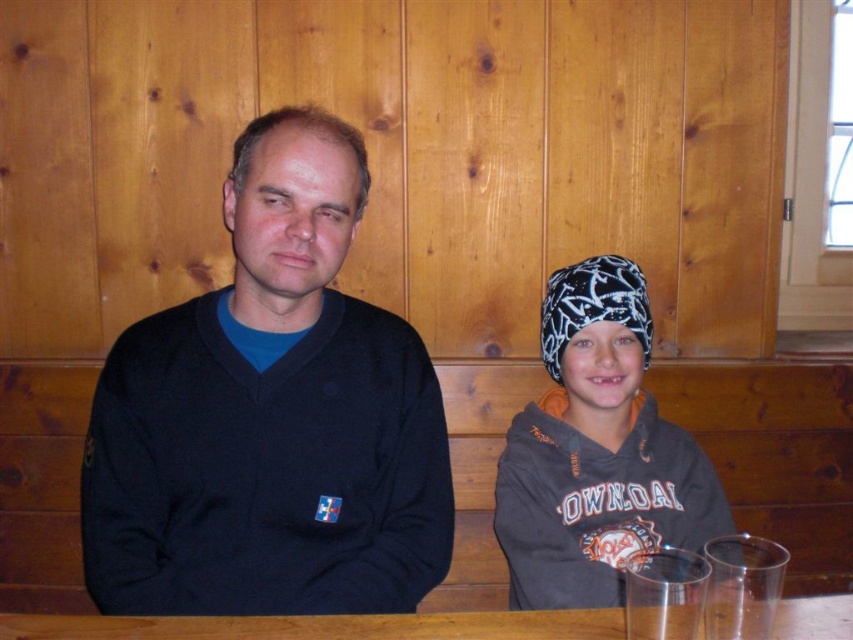
You are designing a new tablecloth for the wooden table at center. The dark gray hoodie at center is placed on the table. Will the tablecloth need to be wider than the hoodie to cover the entire table?

The dark gray hoodie at center has a lesser width compared to wooden table at center. Therefore, the tablecloth must be wider than the hoodie to cover the entire table since the table is wider than the hoodie.

You are a tailor who needs to determine which garment has a larger width to fit a customer. You observe the black matte sweater at center and the dark gray hoodie at center in the image. Which one has a greater width?

The black matte sweater at center has a greater width than the dark gray hoodie at center according to the description.

You are a photographer setting up a photo shoot. You have a dark gray hoodie at center and a wooden table at center in the scene. Which object is taller?

The dark gray hoodie at center is much taller than the wooden table at center.